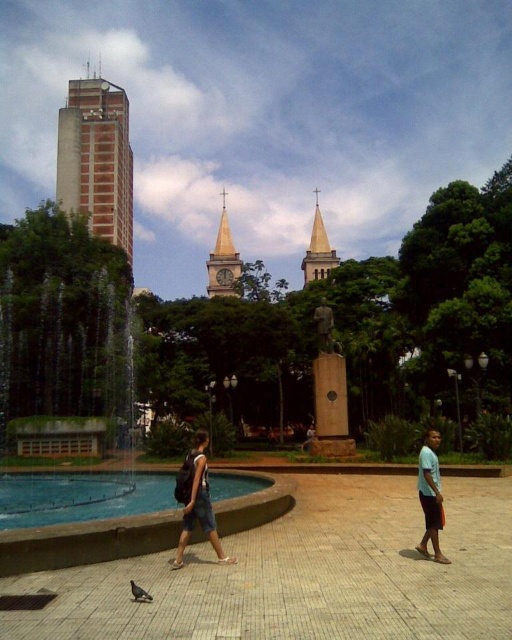
You are standing at the fountain on the left side of the square. You want to walk straight ahead to reach the statue in the center. Will you pass by point (124,170) or point (132,589) first?

You will pass by point (132,589) first because it is in front of point (124,170) along your path from the fountain to the statue.

You are a photographer positioned at the center of the square. You want to capture a photo of the gray matte pigeon at lower left without the concrete tower at left blocking it. Is this possible given their current positions?

The gray matte pigeon at lower left is behind the concrete tower at left, so it would be blocked by the tower in the photo.